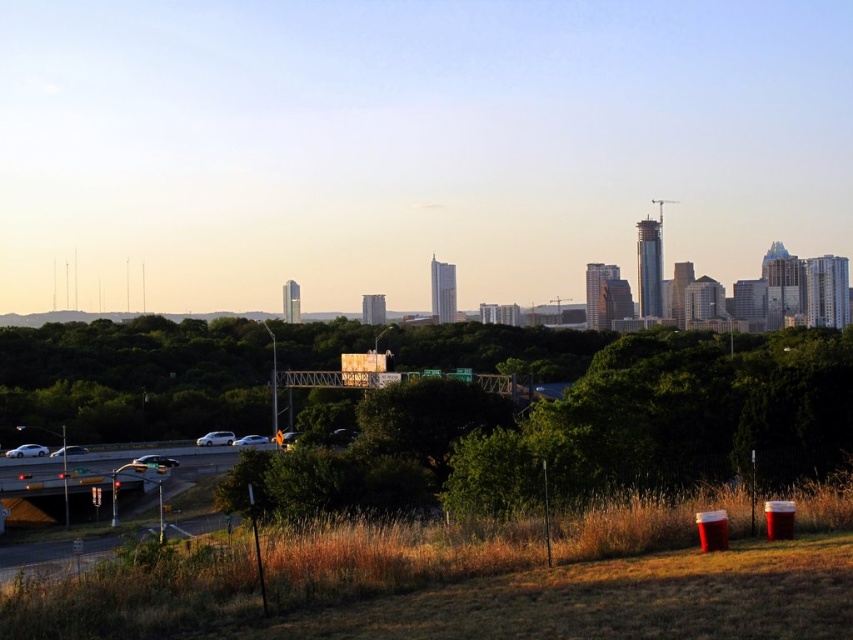
Which is more to the left, white matte car at lower left or silver metallic car at lower left?

From the viewer's perspective, silver metallic car at lower left appears more on the left side.

Who is shorter, white matte car at lower left or silver metallic car at lower left?

With less height is white matte car at lower left.

You are a GUI agent. You are given a task and a screenshot of the screen. Output one action in this format:
    pyautogui.click(x=<x>, y=<y>)
    Task: Click on the white matte car at lower left
    This screenshot has width=853, height=640.
    Given the screenshot: What is the action you would take?
    pyautogui.click(x=215, y=438)

Is satin black sedan at lower center further to camera compared to silver metallic car at lower left?

No, satin black sedan at lower center is closer to the viewer.

Is satin black sedan at lower center positioned before silver metallic car at lower left?

Yes, satin black sedan at lower center is closer to the viewer.

Who is more distant from viewer, (149, 465) or (76, 451)?

The point (76, 451) is more distant.

Where is `satin black sedan at lower center`? This screenshot has height=640, width=853. satin black sedan at lower center is located at coordinates 155,460.

Between point (33, 444) and point (151, 461), which one is positioned in front?

Positioned in front is point (151, 461).

Is silver metallic sedan at lower left closer to camera compared to satin black sedan at lower center?

No, silver metallic sedan at lower left is behind satin black sedan at lower center.

Is point (32, 456) closer to viewer compared to point (161, 460)?

No, (32, 456) is behind (161, 460).

Where is `silver metallic sedan at lower left`? silver metallic sedan at lower left is located at coordinates (27, 451).